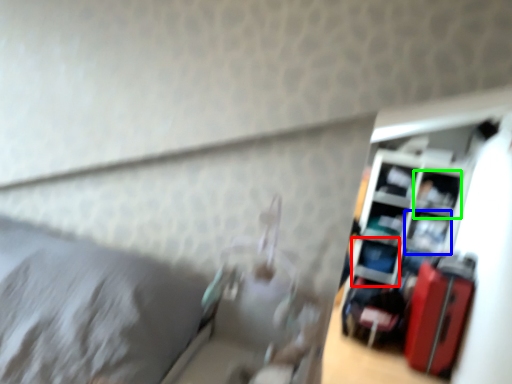
Question: Which object is the farthest from shelf (highlighted by a red box)? Choose among these: shelf (highlighted by a blue box) or shelf (highlighted by a green box).

Choices:
 (A) shelf
 (B) shelf

Answer: (B)